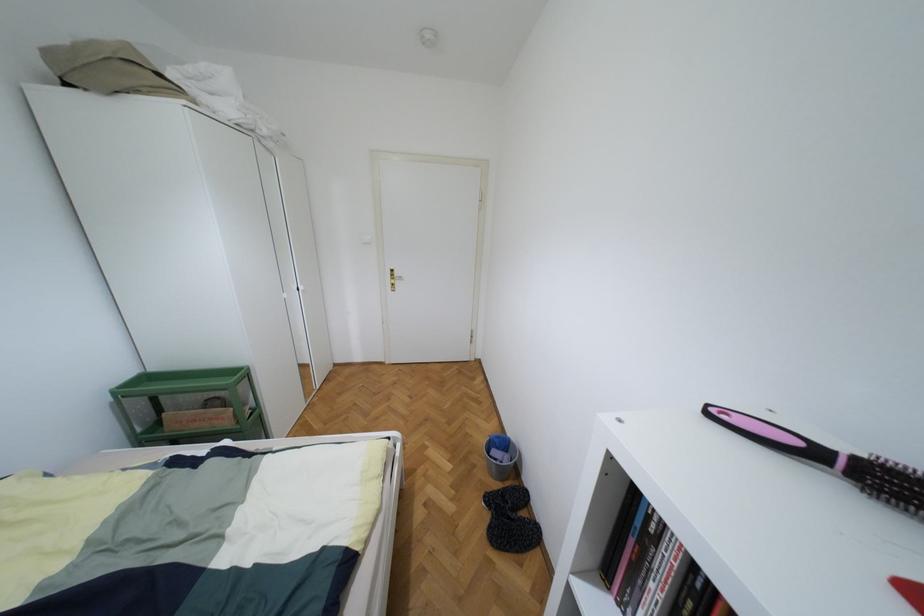
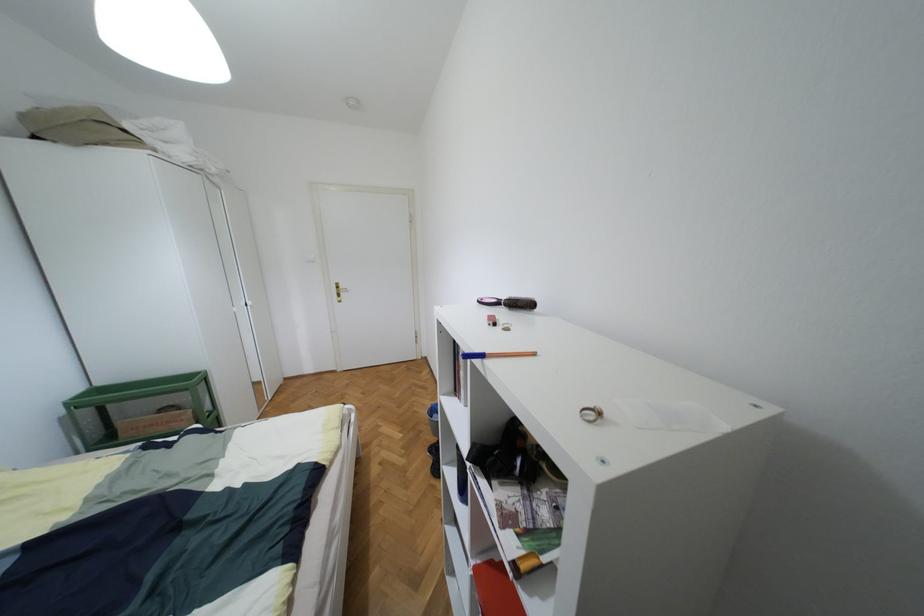
Question: What movement of the cameraman would produce the second image?

Choices:
 (A) Left
 (B) Right
 (C) Forward
 (D) Backward

Answer: (D)